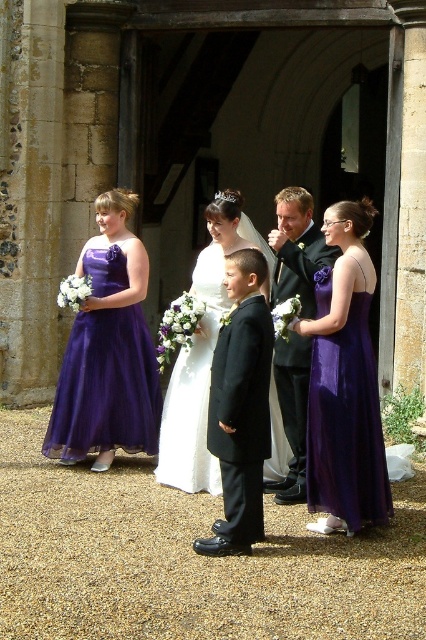
Question: Which object appears closest to the camera in this image?

Choices:
 (A) matte purple dress at center
 (B) purple satin dress at center
 (C) purple satin dress at left
 (D) black satin suit at center

Answer: (D)

Question: From the image, what is the correct spatial relationship of matte purple dress at center in relation to white satin dress at center?

Choices:
 (A) above
 (B) below

Answer: (B)

Question: Is purple satin dress at left below black satin suit at center?

Choices:
 (A) no
 (B) yes

Answer: (A)

Question: Considering the real-world distances, which object is farthest from the purple satin dress at center?

Choices:
 (A) white satin dress at center
 (B) matte purple dress at center
 (C) shiny black suit at center
 (D) black satin suit at center

Answer: (A)

Question: Is purple satin dress at center positioned in front of black satin suit at center?

Choices:
 (A) yes
 (B) no

Answer: (B)

Question: Based on their relative distances, which object is farther from the matte purple dress at center?

Choices:
 (A) purple satin dress at left
 (B) shiny black suit at center
 (C) purple satin dress at center
 (D) black satin suit at center

Answer: (A)